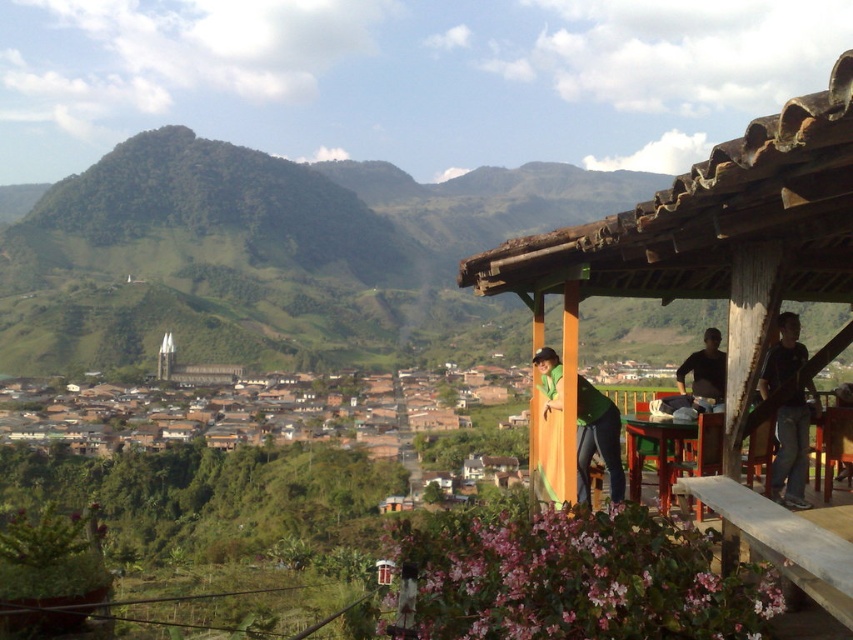
You are standing on the balcony and want to know if the dark blue jeans at right can be placed next to the black matte shirt at upper right without overlapping. Based on their widths, is there enough space?

The dark blue jeans at right has a lesser width compared to the black matte shirt at upper right, so there should be enough space to place them next to each other without overlapping.

You are standing on the balcony and want to take a photo of the dark blue jeans at right and the black matte shirt at upper right. Which object should you focus on first if you want to ensure both are in focus without adjusting the camera settings?

You should focus on the dark blue jeans at right first because it has a greater height compared to the black matte shirt at upper right, so it will be closer to the camera.